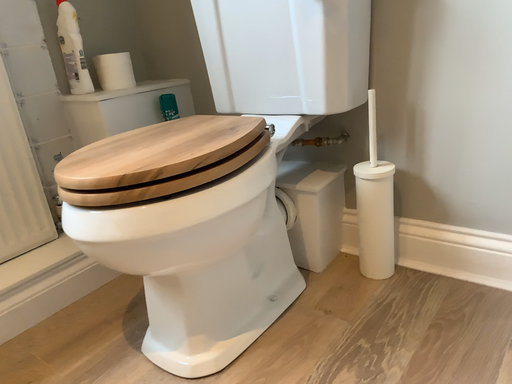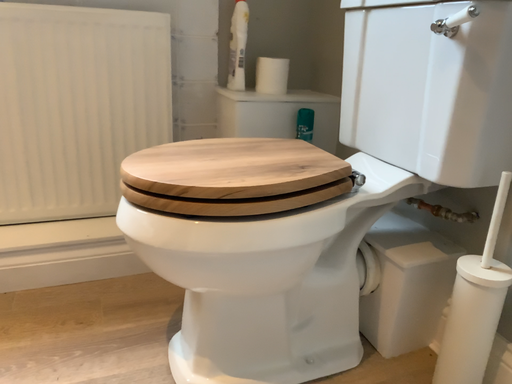
Question: Which way did the camera rotate in the video?

Choices:
 (A) rotated left
 (B) rotated right

Answer: (A)